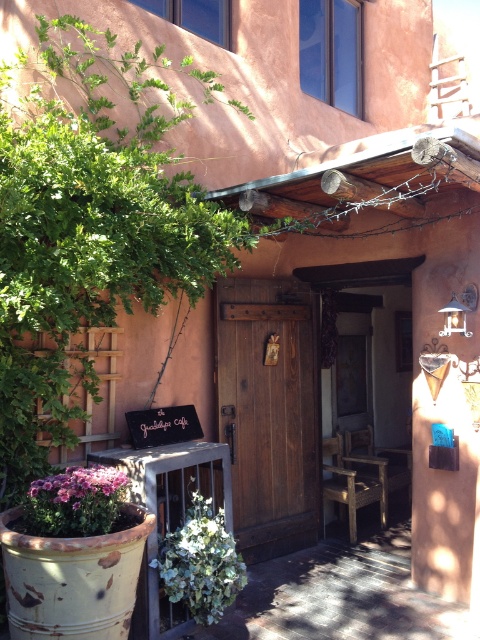
You are a delivery person approaching the entrance of the Guadalupe Cafe. You need to deliver a package to the front desk inside. The green leafy plant at lower center is blocking your path to the rustic wood door at center. Can you move the plant to access the door?

The rustic wood door at center is positioned over the green leafy plant at lower center, meaning the door is above the plant. Since the door is above the plant, you don not need to move the plant to access the door.

You are standing at the entrance of the Guadalupe Cafe and see two points marked on the ground. The first point is at coordinate point(284, 342) and the second point is at coordinate point(46, 502). Which point is closer to you?

Point(46, 502) is closer to you because it is in front of point(284, 342).